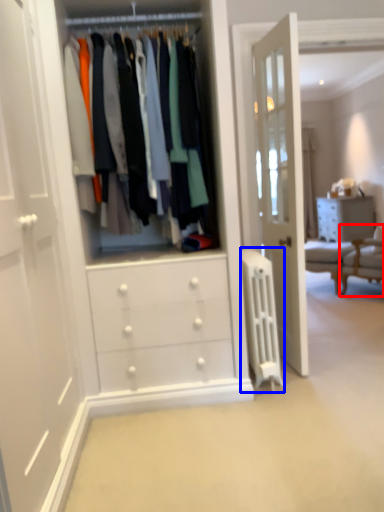
Question: Which of the following is the farthest to the observer, furniture (highlighted by a red box) or wide (highlighted by a blue box)?

Choices:
 (A) furniture
 (B) wide

Answer: (A)